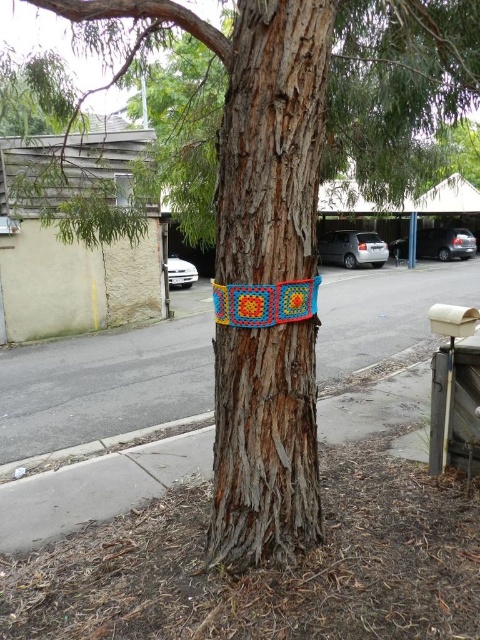
Question: Does textured concrete pavement at center have a smaller size compared to knitted yarn blanket at center?

Choices:
 (A) yes
 (B) no

Answer: (B)

Question: Which object appears closest to the camera in this image?

Choices:
 (A) knitted yarn blanket at center
 (B) textured concrete pavement at center
 (C) wooden textured tree trunk at center

Answer: (C)

Question: Can you confirm if wooden textured tree trunk at center is positioned to the right of textured concrete pavement at center?

Choices:
 (A) yes
 (B) no

Answer: (B)

Question: Based on their relative distances, which object is nearer to the knitted yarn blanket at center?

Choices:
 (A) textured concrete pavement at center
 (B) wooden textured tree trunk at center

Answer: (B)

Question: Does wooden textured tree trunk at center come in front of knitted yarn blanket at center?

Choices:
 (A) no
 (B) yes

Answer: (B)

Question: Which point is closer to the camera taking this photo?

Choices:
 (A) (60, 419)
 (B) (288, 97)
 (C) (252, 317)

Answer: (B)